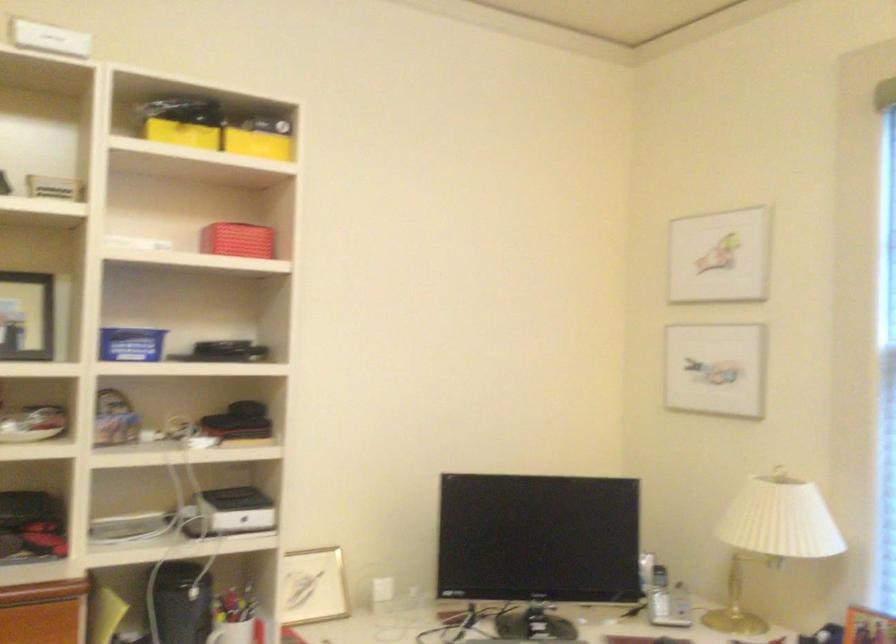
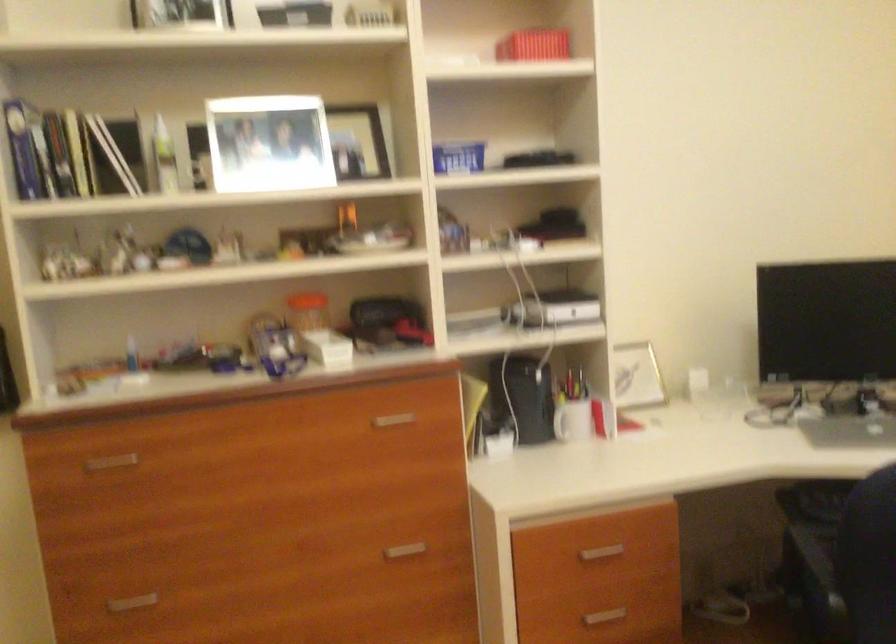
Question: I am providing you with two images of the same scene from different viewpoints. Please identify which objects are invisible in image2.

Choices:
 (A) red box
 (B) silver drawer handle
 (C) white spray bottle
 (D) none of these

Answer: (D)